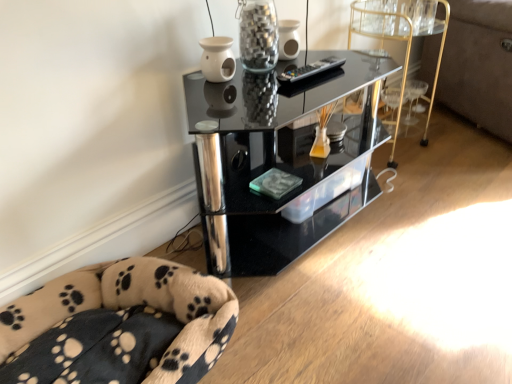
Question: Can you confirm if fluffy beige dog bed at lower left is smaller than transparent glass jar at upper center?

Choices:
 (A) no
 (B) yes

Answer: (A)

Question: Considering the relative positions of fluffy beige dog bed at lower left and transparent glass jar at upper center in the image provided, is fluffy beige dog bed at lower left to the right of transparent glass jar at upper center from the viewer's perspective?

Choices:
 (A) yes
 (B) no

Answer: (B)

Question: Can you confirm if fluffy beige dog bed at lower left is shorter than transparent glass jar at upper center?

Choices:
 (A) yes
 (B) no

Answer: (A)

Question: Is fluffy beige dog bed at lower left with transparent glass jar at upper center?

Choices:
 (A) yes
 (B) no

Answer: (B)

Question: From a real-world perspective, does fluffy beige dog bed at lower left stand above transparent glass jar at upper center?

Choices:
 (A) no
 (B) yes

Answer: (A)

Question: Do you think black glass shelf at center is within fluffy beige dog bed at lower left, or outside of it?

Choices:
 (A) outside
 (B) inside

Answer: (A)

Question: Considering the positions of black glass shelf at center and fluffy beige dog bed at lower left in the image, is black glass shelf at center wider or thinner than fluffy beige dog bed at lower left?

Choices:
 (A) thin
 (B) wide

Answer: (A)

Question: Based on their sizes in the image, would you say black glass shelf at center is bigger or smaller than fluffy beige dog bed at lower left?

Choices:
 (A) big
 (B) small

Answer: (A)

Question: Would you say black glass shelf at center is to the left or to the right of fluffy beige dog bed at lower left in the picture?

Choices:
 (A) right
 (B) left

Answer: (A)

Question: In terms of width, does fluffy beige dog bed at lower left look wider or thinner when compared to transparent glass jar at upper center?

Choices:
 (A) wide
 (B) thin

Answer: (A)

Question: Visually, is fluffy beige dog bed at lower left positioned to the left or to the right of transparent glass jar at upper center?

Choices:
 (A) left
 (B) right

Answer: (A)

Question: In the image, is fluffy beige dog bed at lower left positioned in front of or behind transparent glass jar at upper center?

Choices:
 (A) behind
 (B) front

Answer: (B)

Question: From their relative heights in the image, would you say fluffy beige dog bed at lower left is taller or shorter than transparent glass jar at upper center?

Choices:
 (A) tall
 (B) short

Answer: (B)

Question: Is point (268, 96) closer or farther from the camera than point (401, 18)?

Choices:
 (A) farther
 (B) closer

Answer: (B)

Question: Relative to gold metallic bar cart at center right, is black glass shelf at center in front or behind?

Choices:
 (A) front
 (B) behind

Answer: (A)